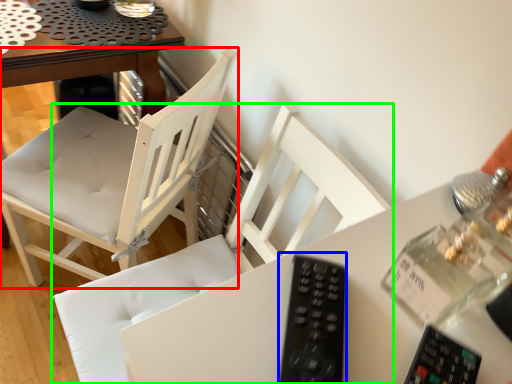
Question: Which is nearer to the chair (highlighted by a red box)? remote (highlighted by a blue box) or chair (highlighted by a green box).

Choices:
 (A) remote
 (B) chair

Answer: (B)